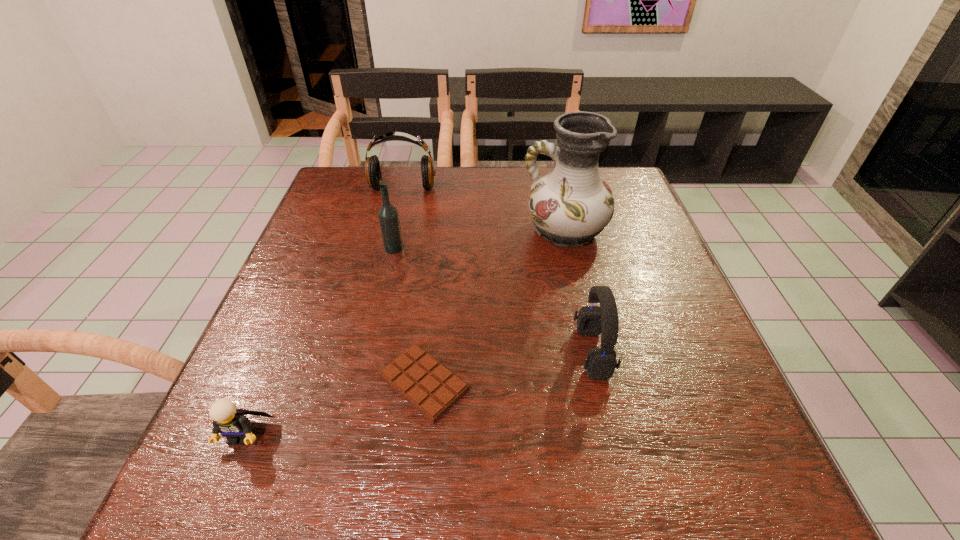
The height and width of the screenshot is (540, 960). I want to click on vacant area that lies between the candy bar and the left headset, so click(414, 286).

At what (x,y) coordinates should I click in order to perform the action: click on vacant space in between the vodka and the second shortest object. Please return your answer as a coordinate pair (x, y). This screenshot has width=960, height=540. Looking at the image, I should click on (319, 341).

At what (x,y) coordinates should I click in order to perform the action: click on free spot between the farthest object and the nearer headset. Please return your answer as a coordinate pair (x, y). Looking at the image, I should click on (497, 270).

You are a GUI agent. You are given a task and a screenshot of the screen. Output one action in this format:
    pyautogui.click(x=<x>, y=<y>)
    Task: Click on the vacant space in between the nearer headset and the farther headset
    
    Given the screenshot: What is the action you would take?
    pyautogui.click(x=497, y=270)

Point out which object is positioned as the third nearest to the tallest object. Please provide its 2D coordinates. Your answer should be formatted as a tuple, i.e. [(x, y)], where the tuple contains the x and y coordinates of a point satisfying the conditions above.

[(388, 216)]

Locate which object is the fourth closest to the candy bar. Please provide its 2D coordinates. Your answer should be formatted as a tuple, i.e. [(x, y)], where the tuple contains the x and y coordinates of a point satisfying the conditions above.

[(571, 205)]

Where is `vacant region that satisfies the following two spatial constraints: 1. on the back side of the shortest object; 2. on the left side of the vase`? vacant region that satisfies the following two spatial constraints: 1. on the back side of the shortest object; 2. on the left side of the vase is located at coordinates (441, 231).